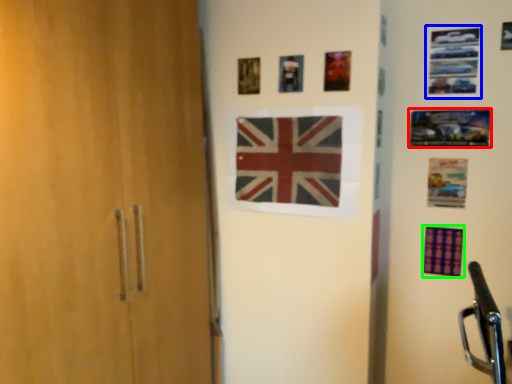
Question: Which object is the farthest from picture frame (highlighted by a red box)? Choose among these: picture frame (highlighted by a blue box) or flag (highlighted by a green box).

Choices:
 (A) picture frame
 (B) flag

Answer: (B)